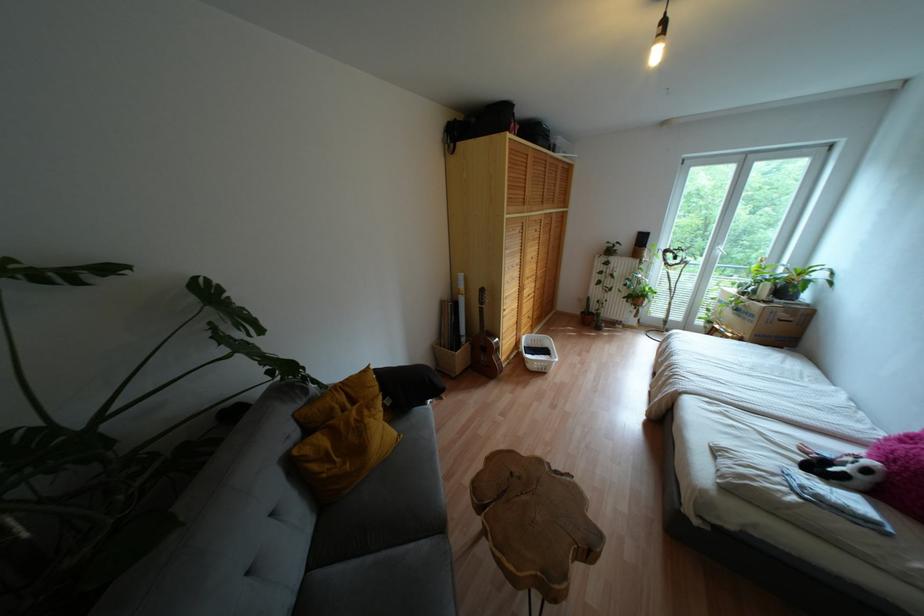
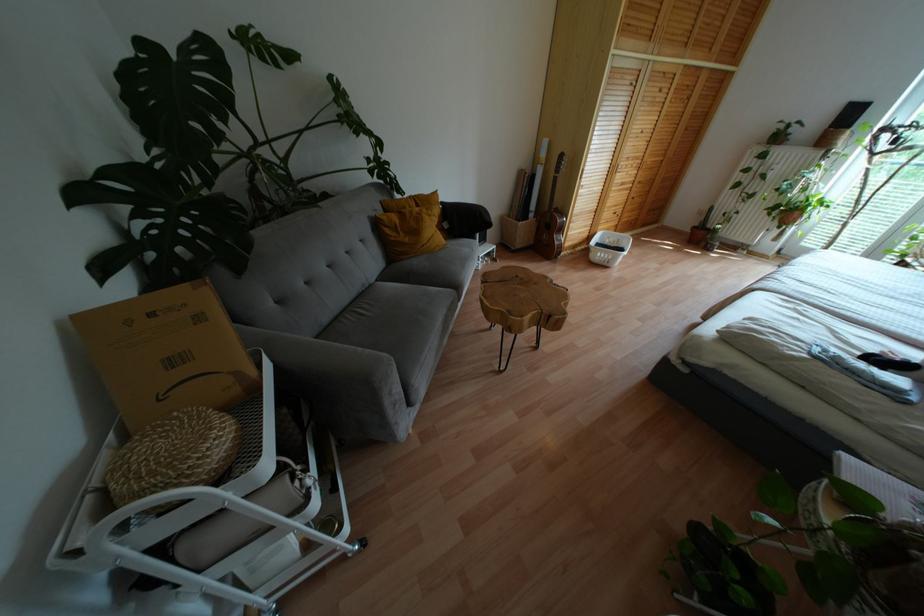
In the second image, find the point that corresponds to [542,370] in the first image.

(604, 262)